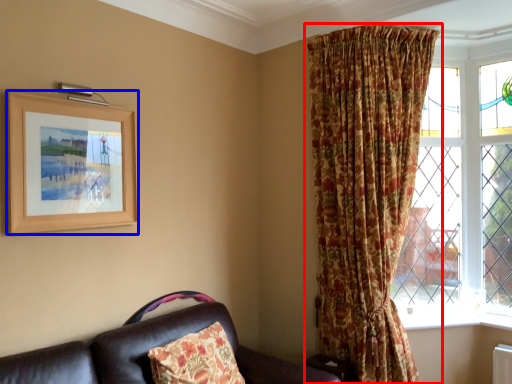
Question: Among these objects, which one is farthest to the camera, curtain (highlighted by a red box) or picture frame (highlighted by a blue box)?

Choices:
 (A) curtain
 (B) picture frame

Answer: (A)